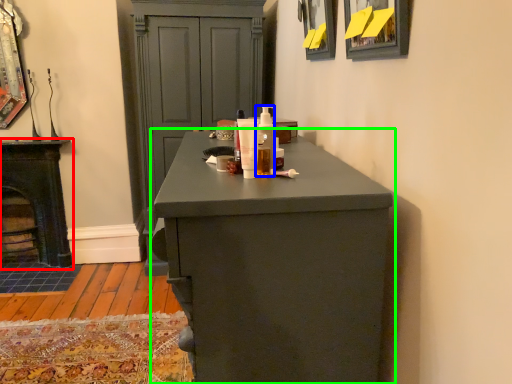
Question: Which is nearer to the stove (highlighted by a red box)? mouthwash (highlighted by a blue box) or chest of drawers (highlighted by a green box).

Choices:
 (A) mouthwash
 (B) chest of drawers

Answer: (A)